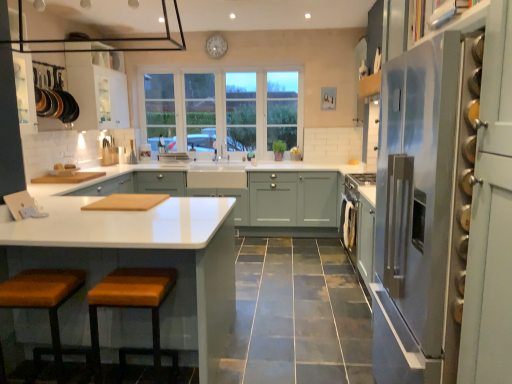
Locate an element on the screen. white glossy countertop at center, which ranks as the 1th cabinetry in front-to-back order is located at coordinates (143, 259).

Locate an element on the screen. The height and width of the screenshot is (384, 512). leather cushioned stool at lower left, which ranks as the first stool in left-to-right order is located at coordinates click(45, 301).

How much space does leather cushioned stool at lower left, which ranks as the first stool in left-to-right order, occupy vertically?

leather cushioned stool at lower left, which ranks as the first stool in left-to-right order, is 26.39 inches in height.

Describe the element at coordinates (446, 209) in the screenshot. Image resolution: width=512 pixels, height=384 pixels. I see `satin silver refrigerator at right` at that location.

Describe the element at coordinates (223, 110) in the screenshot. This screenshot has width=512, height=384. I see `white wood window at center` at that location.

Where is `black glass exhaust hood at upper center`? black glass exhaust hood at upper center is located at coordinates (101, 38).

Could you tell me if white plastic clock at upper center is facing leather cushioned stool at lower left, which appears as the second stool when viewed from the right?

No, white plastic clock at upper center does not turn towards leather cushioned stool at lower left, which appears as the second stool when viewed from the right.

Where is `the 2nd stool in front when counting from the white plastic clock at upper center`? the 2nd stool in front when counting from the white plastic clock at upper center is located at coordinates (45, 301).

Is white plastic clock at upper center positioned behind leather cushioned stool at lower left, which appears as the second stool when viewed from the right?

Yes, the depth of white plastic clock at upper center is greater than that of leather cushioned stool at lower left, which appears as the second stool when viewed from the right.

Which object is thinner, black glass exhaust hood at upper center or orange leather stool at lower left, the first stool from the right?

black glass exhaust hood at upper center is thinner.

Would you say black glass exhaust hood at upper center is to the left or to the right of orange leather stool at lower left, the 2th stool in the left-to-right sequence, in the picture?

black glass exhaust hood at upper center is to the left of orange leather stool at lower left, the 2th stool in the left-to-right sequence.

Is black glass exhaust hood at upper center bigger than orange leather stool at lower left, the first stool from the right?

Yes.

Does white glossy countertop at center, the second cabinetry in the back-to-front sequence, appear on the left side of white wood window at center?

Correct, you'll find white glossy countertop at center, the second cabinetry in the back-to-front sequence, to the left of white wood window at center.

Does white glossy countertop at center, the second cabinetry in the back-to-front sequence, have a greater height compared to white wood window at center?

No, white glossy countertop at center, the second cabinetry in the back-to-front sequence, is not taller than white wood window at center.

From the image's perspective, is white glossy countertop at center, which ranks as the 1th cabinetry in front-to-back order, under white wood window at center?

Yes, from the image's perspective, white glossy countertop at center, which ranks as the 1th cabinetry in front-to-back order, is beneath white wood window at center.

Can you confirm if white glossy countertop at center, the second cabinetry in the back-to-front sequence, is smaller than white wood window at center?

Actually, white glossy countertop at center, the second cabinetry in the back-to-front sequence, might be larger than white wood window at center.

Find the location of a particular element. refrigerator beneath the white plastic clock at upper center (from a real-world perspective) is located at coordinates (446, 209).

Which object is positioned more to the right, white plastic clock at upper center or satin silver refrigerator at right?

From the viewer's perspective, satin silver refrigerator at right appears more on the right side.

Looking at this image, which is correct: white plastic clock at upper center is inside satin silver refrigerator at right, or outside of it?

white plastic clock at upper center is located beyond the bounds of satin silver refrigerator at right.

Is white plastic clock at upper center looking in the opposite direction of satin silver refrigerator at right?

white plastic clock at upper center is not turned away from satin silver refrigerator at right.

Considering the sizes of white plastic clock at upper center and black glass exhaust hood at upper center in the image, is white plastic clock at upper center wider or thinner than black glass exhaust hood at upper center?

white plastic clock at upper center is thinner than black glass exhaust hood at upper center.

Which is more to the right, white plastic clock at upper center or black glass exhaust hood at upper center?

Positioned to the right is white plastic clock at upper center.

From the image's perspective, is white plastic clock at upper center located above black glass exhaust hood at upper center?

Yes, from the image's perspective, white plastic clock at upper center is above black glass exhaust hood at upper center.

Consider the image. Between white plastic clock at upper center and black glass exhaust hood at upper center, which one is positioned in front?

black glass exhaust hood at upper center is in front.

The width and height of the screenshot is (512, 384). I want to click on clock behind the white glossy drawer at center, so click(216, 46).

Can you confirm if white plastic clock at upper center is taller than white glossy drawer at center?

Indeed, white plastic clock at upper center has a greater height compared to white glossy drawer at center.

Would you say white glossy drawer at center is part of white plastic clock at upper center's contents?

No, white plastic clock at upper center does not contain white glossy drawer at center.

From a real-world perspective, is white plastic clock at upper center above or below white glossy drawer at center?

white plastic clock at upper center is situated higher than white glossy drawer at center in the real world.

Considering the positions of objects satin silver refrigerator at right and matte white cabinets at center, the second cabinetry viewed from the front, in the image provided, who is more to the left, satin silver refrigerator at right or matte white cabinets at center, the second cabinetry viewed from the front,?

Positioned to the left is matte white cabinets at center, the second cabinetry viewed from the front.

From the image's perspective, is satin silver refrigerator at right beneath matte white cabinets at center, the second cabinetry viewed from the front?

No, from the image's perspective, satin silver refrigerator at right is not beneath matte white cabinets at center, the second cabinetry viewed from the front.

From a real-world perspective, is satin silver refrigerator at right positioned above or below matte white cabinets at center, the second cabinetry viewed from the front?

From a real-world perspective, satin silver refrigerator at right is physically above matte white cabinets at center, the second cabinetry viewed from the front.

In the image, there is a matte white cabinets at center, the second cabinetry viewed from the front. Identify the location of refrigerator above it (from the image's perspective). (446, 209).

From the white plastic clock at upper center, count the 2nd stool to the left and point to it. Please provide its 2D coordinates.

[(45, 301)]

Find the location of a particular element. Image resolution: width=512 pixels, height=384 pixels. exhaust hood in front of the orange leather stool at lower left, the first stool from the right is located at coordinates (101, 38).

Estimate the real-world distances between objects in this image. Which object is further from matte white cabinets at center, marked as the first cabinetry in a back-to-front arrangement, orange leather stool at lower left, the 2th stool in the left-to-right sequence, or leather cushioned stool at lower left, which ranks as the first stool in left-to-right order?

leather cushioned stool at lower left, which ranks as the first stool in left-to-right order, is further to matte white cabinets at center, marked as the first cabinetry in a back-to-front arrangement.

Looking at the image, which one is located further to leather cushioned stool at lower left, which ranks as the first stool in left-to-right order, matte white cabinets at center, the second cabinetry viewed from the front, or white glossy drawer at center?

The object further to leather cushioned stool at lower left, which ranks as the first stool in left-to-right order, is white glossy drawer at center.

Which object lies nearer to the anchor point matte white cabinets at center, marked as the first cabinetry in a back-to-front arrangement, black glass exhaust hood at upper center or orange leather stool at lower left, the 2th stool in the left-to-right sequence?

black glass exhaust hood at upper center lies closer to matte white cabinets at center, marked as the first cabinetry in a back-to-front arrangement, than the other object.

Considering their positions, is satin silver refrigerator at right positioned further to white glossy countertop at center, which ranks as the 1th cabinetry in front-to-back order, than white plastic clock at upper center?

white plastic clock at upper center is positioned further to the anchor white glossy countertop at center, which ranks as the 1th cabinetry in front-to-back order.

Which object lies further to the anchor point satin silver refrigerator at right, white plastic clock at upper center or orange leather stool at lower left, the first stool from the right?

The object further to satin silver refrigerator at right is white plastic clock at upper center.

Which object lies nearer to the anchor point black glass exhaust hood at upper center, white glossy countertop at center, which ranks as the 1th cabinetry in front-to-back order, or white plastic clock at upper center?

white plastic clock at upper center is positioned closer to the anchor black glass exhaust hood at upper center.

Estimate the real-world distances between objects in this image. Which object is closer to white glossy countertop at center, which ranks as the 1th cabinetry in front-to-back order, white glossy drawer at center or matte white cabinets at center, marked as the first cabinetry in a back-to-front arrangement?

Based on the image, matte white cabinets at center, marked as the first cabinetry in a back-to-front arrangement, appears to be nearer to white glossy countertop at center, which ranks as the 1th cabinetry in front-to-back order.

Based on the photo, based on their spatial positions, is satin silver refrigerator at right or orange leather stool at lower left, the 2th stool in the left-to-right sequence, closer to matte white cabinets at center, the second cabinetry viewed from the front?

orange leather stool at lower left, the 2th stool in the left-to-right sequence, is positioned closer to the anchor matte white cabinets at center, the second cabinetry viewed from the front.

Find the location of a particular element. This screenshot has height=384, width=512. exhaust hood between satin silver refrigerator at right and white glossy drawer at center along the z-axis is located at coordinates (101, 38).

Locate an element on the screen. drawer located between white glossy countertop at center, the second cabinetry in the back-to-front sequence, and white wood window at center in the depth direction is located at coordinates (216, 179).

You are a GUI agent. You are given a task and a screenshot of the screen. Output one action in this format:
    pyautogui.click(x=<x>, y=<y>)
    Task: Click on the exhaust hood between leather cushioned stool at lower left, which ranks as the first stool in left-to-right order, and satin silver refrigerator at right, in the horizontal direction
    The image size is (512, 384).
    Given the screenshot: What is the action you would take?
    pyautogui.click(x=101, y=38)

Find the location of `stool between leather cushioned stool at lower left, which appears as the second stool when viewed from the right, and white glossy drawer at center from front to back`. stool between leather cushioned stool at lower left, which appears as the second stool when viewed from the right, and white glossy drawer at center from front to back is located at coordinates (133, 307).